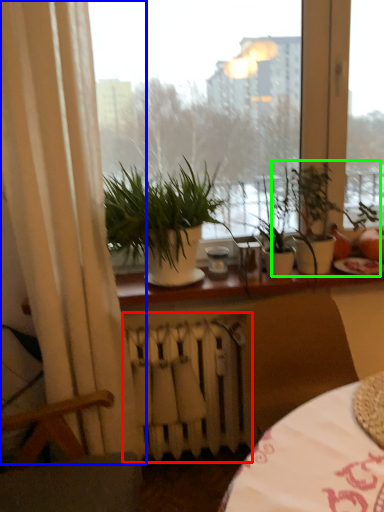
Question: Estimate the real-world distances between objects in this image. Which object is farther from radiator (highlighted by a red box), curtain (highlighted by a blue box) or houseplant (highlighted by a green box)?

Choices:
 (A) curtain
 (B) houseplant

Answer: (B)